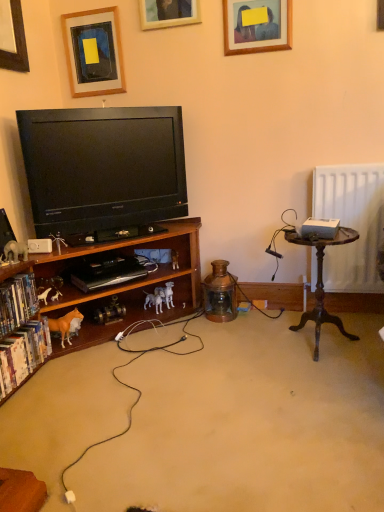
Where is `vacant area that lies between white plastic dog at lower center, marked as the second toy in a right-to-left arrangement, and wooden vintage table at right`? vacant area that lies between white plastic dog at lower center, marked as the second toy in a right-to-left arrangement, and wooden vintage table at right is located at coordinates [x=237, y=332].